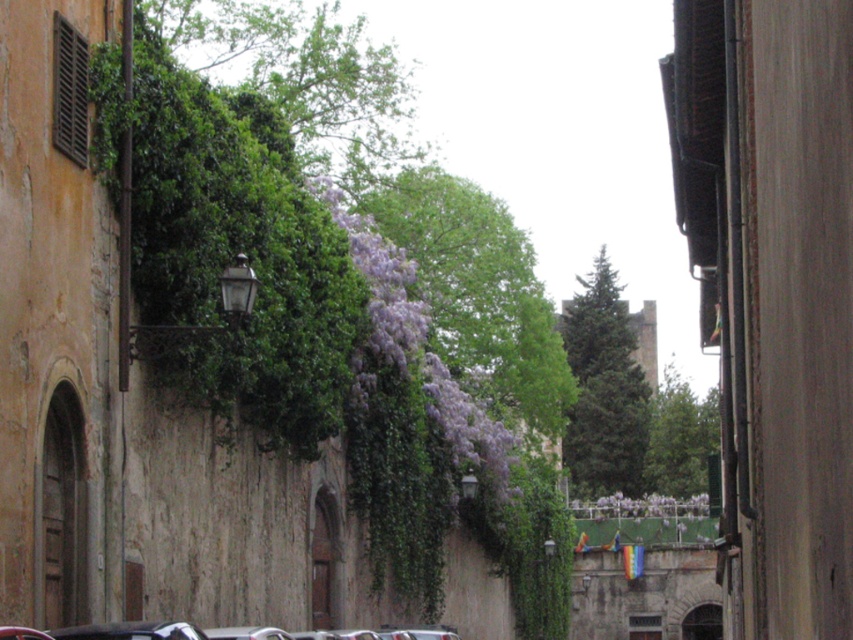
Question: Among these points, which one is nearest to the camera?

Choices:
 (A) (273, 28)
 (B) (596, 440)
 (C) (705, 429)

Answer: (A)

Question: From the image, what is the correct spatial relationship of green leafy tree at upper left in relation to green matte tree at center?

Choices:
 (A) left
 (B) right

Answer: (A)

Question: Which point is farther to the camera?

Choices:
 (A) green matte tree at center
 (B) purple leafy tree at center
 (C) green leafy tree at center

Answer: (A)

Question: Does purple leafy tree at center appear over green leafy tree at upper left?

Choices:
 (A) no
 (B) yes

Answer: (A)

Question: Is green matte tree at center bigger than green leafy tree at center?

Choices:
 (A) no
 (B) yes

Answer: (A)

Question: Which is farther from the green leafy tree at center?

Choices:
 (A) purple leafy tree at center
 (B) green leafy tree at upper left

Answer: (B)